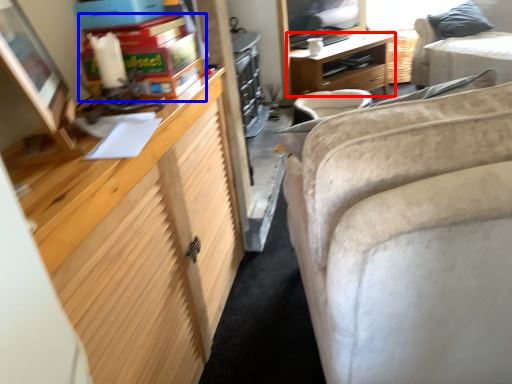
Question: Which of the following is the farthest to the observer, desk (highlighted by a red box) or toy (highlighted by a blue box)?

Choices:
 (A) desk
 (B) toy

Answer: (A)